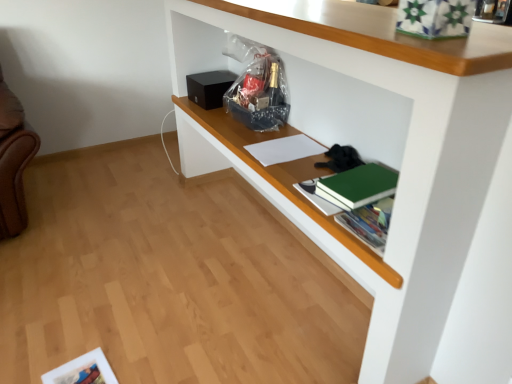
This screenshot has width=512, height=384. What do you see at coordinates (284, 149) in the screenshot? I see `white paper at center` at bounding box center [284, 149].

Locate an element on the screen. white paper at center is located at coordinates (284, 149).

Does point (406, 338) appear closer or farther from the camera than point (309, 151)?

Point (406, 338) appears to be closer to the viewer than point (309, 151).

Who is bigger, white matte shelf at upper center or white paper at center?

white matte shelf at upper center.

From their relative heights in the image, would you say white matte shelf at upper center is taller or shorter than white paper at center?

In the image, white matte shelf at upper center appears to be taller than white paper at center.

Can we say white matte shelf at upper center lies outside white paper at center?

Yes, white matte shelf at upper center is located beyond the bounds of white paper at center.

Considering the relative sizes of green matte book at center-right and white matte shelf at upper center in the image provided, is green matte book at center-right bigger than white matte shelf at upper center?

Incorrect, green matte book at center-right is not larger than white matte shelf at upper center.

Find the location of a particular element. paperback book above the white matte shelf at upper center (from a real-world perspective) is located at coordinates (358, 186).

Between green matte book at center-right and white matte shelf at upper center, which one is positioned behind?

green matte book at center-right is further from the camera.

Does green matte book at center-right contain white matte shelf at upper center?

Definitely not — white matte shelf at upper center is not inside green matte book at center-right.

Measure the distance between white paper at center and white matte shelf at upper center.

white paper at center and white matte shelf at upper center are 23.84 inches apart.

Which object is thinner, white paper at center or white matte shelf at upper center?

Thinner between the two is white paper at center.

Between white paper at center and white matte shelf at upper center, which one is positioned behind?

white paper at center.

Considering the positions of objects white paper at center and white matte shelf at upper center in the image provided, who is more to the left, white paper at center or white matte shelf at upper center?

From the viewer's perspective, white matte shelf at upper center appears more on the left side.

Is white paper at center outside of green matte book at center-right?

white paper at center lies outside green matte book at center-right's area.

Considering the relative sizes of white paper at center and green matte book at center-right in the image provided, is white paper at center shorter than green matte book at center-right?

Yes, white paper at center is shorter than green matte book at center-right.

From the image's perspective, is white paper at center positioned above or below green matte book at center-right?

Based on their image positions, white paper at center is located above green matte book at center-right.

In the scene shown: Is white paper at center oriented away from green matte book at center-right?

white paper at center is not turned away from green matte book at center-right.

Is green matte book at center-right positioned far away from white paper at center?

green matte book at center-right is actually quite close to white paper at center.

Between green matte book at center-right and white paper at center, which one has smaller size?

white paper at center.

Is green matte book at center-right located outside white paper at center?

Yes, green matte book at center-right is outside of white paper at center.

Is point (473, 168) more distant than point (343, 179)?

No, it is not.

Is white matte shelf at upper center thinner than green matte book at center-right?

Incorrect, the width of white matte shelf at upper center is not less than that of green matte book at center-right.

Is white matte shelf at upper center in front of or behind green matte book at center-right in the image?

In the image, white matte shelf at upper center appears in front of green matte book at center-right.

The width and height of the screenshot is (512, 384). In order to click on shelf on the left of white paper at center in this screenshot , I will do `click(399, 178)`.

The height and width of the screenshot is (384, 512). What are the coordinates of `paperback book that is above the white matte shelf at upper center (from a real-world perspective)` in the screenshot? It's located at (358, 186).

From the image, which object appears to be farther from white matte shelf at upper center, green matte book at center-right or white paper at center?

white paper at center.

Based on their spatial positions, is white matte shelf at upper center or green matte book at center-right further from white paper at center?

white matte shelf at upper center.

When comparing their distances from white matte shelf at upper center, does white paper at center or green matte book at center-right seem further?

white paper at center is further to white matte shelf at upper center.

Estimate the real-world distances between objects in this image. Which object is closer to green matte book at center-right, white matte shelf at upper center or white paper at center?

white matte shelf at upper center lies closer to green matte book at center-right than the other object.

From the image, which object appears to be farther from green matte book at center-right, white paper at center or white matte shelf at upper center?

white paper at center.

Looking at the image, which one is located closer to white paper at center, green matte book at center-right or white matte shelf at upper center?

green matte book at center-right.

Where is `paperback book between white matte shelf at upper center and white paper at center from front to back`? The height and width of the screenshot is (384, 512). paperback book between white matte shelf at upper center and white paper at center from front to back is located at coordinates (358, 186).